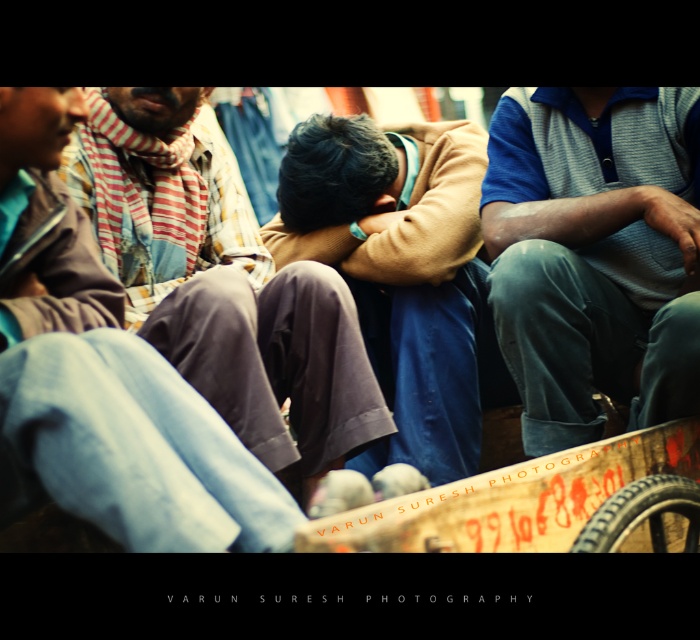
You are a fashion designer observing the street scene. You notice two individuals wearing the blue striped polo shirt at center and the brown woolen sweater at center. Which of these two garments appears to be smaller in size?

The blue striped polo shirt at center is smaller in size compared to the brown woolen sweater at center.

You are a photographer trying to capture a candid shot of the blue striped polo shirt at center and the brown woolen sweater at center. Since you can only focus on one subject at a time, which one should you choose to ensure the other remains in the background?

You should focus on the blue striped polo shirt at center because it is closer to the viewer, allowing the brown woolen sweater at center to naturally appear in the background.